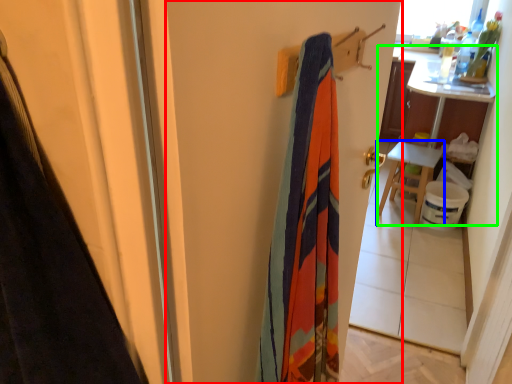
Question: Considering the real-world distances, which object is farthest from screen door (highlighted by a red box)? furniture (highlighted by a blue box) or table (highlighted by a green box)?

Choices:
 (A) furniture
 (B) table

Answer: (B)